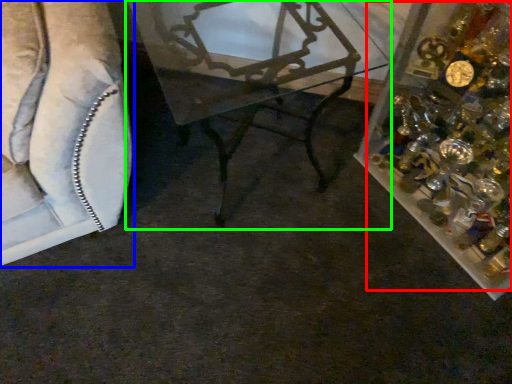
Question: Based on their relative distances, which object is farther from christmas decoration (highlighted by a red box)? Choose from furniture (highlighted by a blue box) and table (highlighted by a green box).

Choices:
 (A) furniture
 (B) table

Answer: (A)